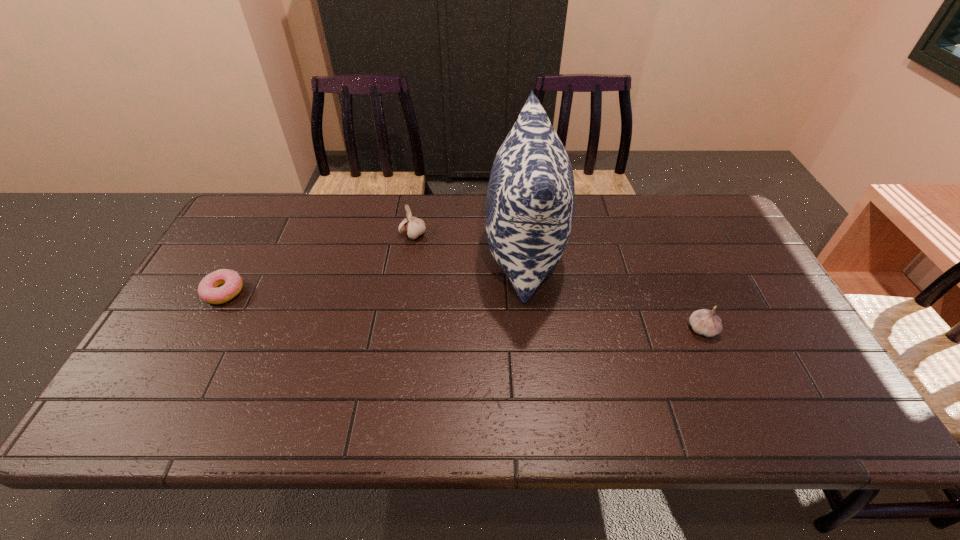
Find the location of a particular element. free location at the right edge is located at coordinates (708, 247).

You are a GUI agent. You are given a task and a screenshot of the screen. Output one action in this format:
    pyautogui.click(x=<x>, y=<y>)
    Task: Click on the free space at the near left corner
    The width and height of the screenshot is (960, 540).
    Given the screenshot: What is the action you would take?
    (174, 429)

Identify the location of vacant space in between the tallest object and the nearest object. The width and height of the screenshot is (960, 540). (613, 291).

Find the location of `empty space between the rightmost object and the leftmost object`. empty space between the rightmost object and the leftmost object is located at coordinates click(x=463, y=310).

At what (x,y) coordinates should I click in order to perform the action: click on empty space that is in between the nearest object and the cushion. Please return your answer as a coordinate pair (x, y). This screenshot has height=540, width=960. Looking at the image, I should click on (613, 291).

Image resolution: width=960 pixels, height=540 pixels. In order to click on vacant area that lies between the right garlic and the third object from left to right in this screenshot , I will do `click(613, 291)`.

Where is `free space between the rightmost object and the tallest object`? free space between the rightmost object and the tallest object is located at coordinates (613, 291).

Where is `unoccupied area between the doughnut and the second object from right to left`? This screenshot has height=540, width=960. unoccupied area between the doughnut and the second object from right to left is located at coordinates (374, 272).

Where is `free spot between the nearest object and the left garlic`? Image resolution: width=960 pixels, height=540 pixels. free spot between the nearest object and the left garlic is located at coordinates (558, 282).

Locate an element on the screen. unoccupied position between the nearer garlic and the doughnut is located at coordinates (463, 310).